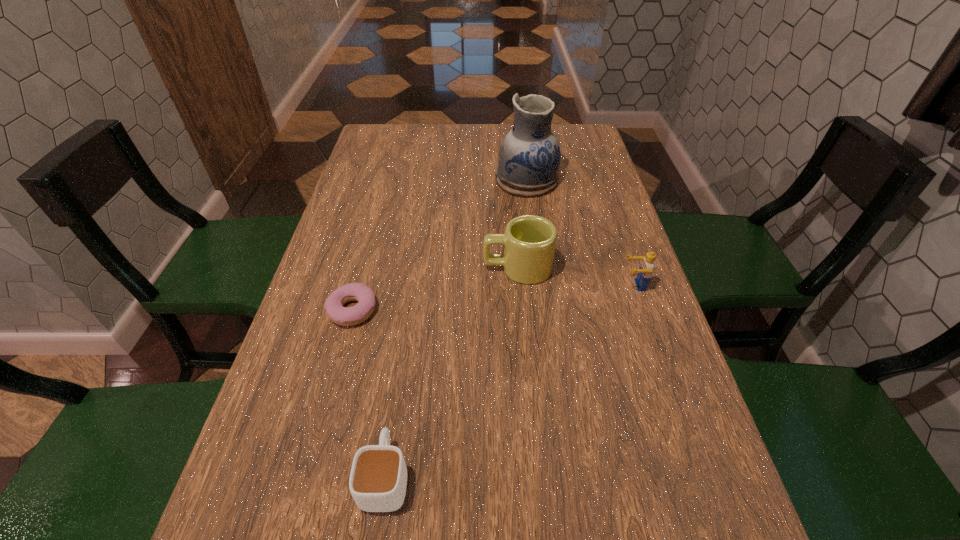
Identify the location of the farthest object. The width and height of the screenshot is (960, 540). (529, 158).

Locate an element on the screen. pottery is located at coordinates (529, 158).

At what (x,y) coordinates should I click in order to perform the action: click on mug. Please return your answer as a coordinate pair (x, y). The image size is (960, 540). Looking at the image, I should click on (529, 241).

The height and width of the screenshot is (540, 960). Find the location of `the rightmost object`. the rightmost object is located at coordinates (645, 271).

Image resolution: width=960 pixels, height=540 pixels. Find the location of `Lego`. Lego is located at coordinates (645, 271).

This screenshot has width=960, height=540. What are the coordinates of `the fourth object from right to left` in the screenshot? It's located at (378, 479).

Locate an element on the screen. Image resolution: width=960 pixels, height=540 pixels. cup is located at coordinates (378, 479).

Identify the location of the shortest object. (346, 316).

The height and width of the screenshot is (540, 960). What are the coordinates of `doughnut` in the screenshot? It's located at (346, 316).

Find the location of `vacant space situated 0.060m on the right of the farthest object`. vacant space situated 0.060m on the right of the farthest object is located at coordinates (578, 180).